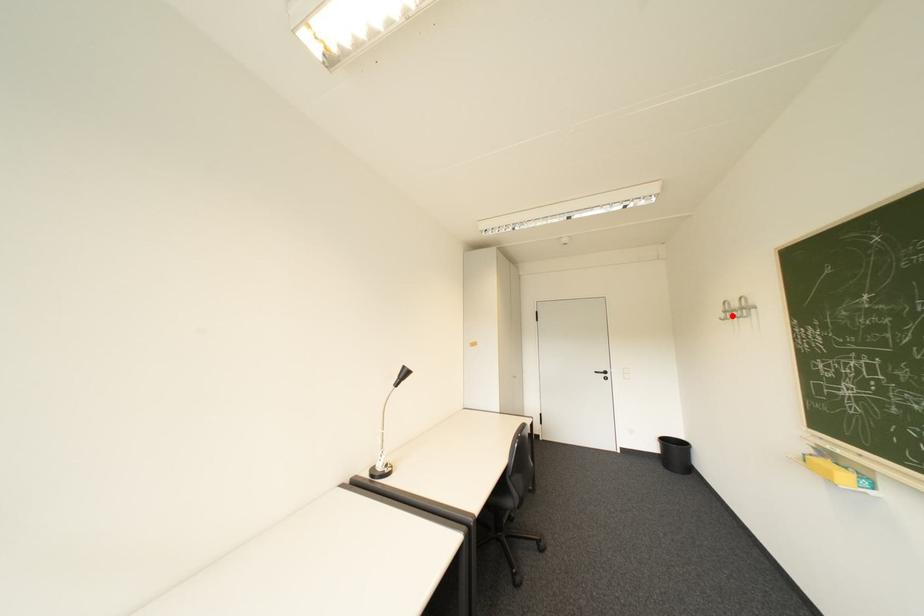
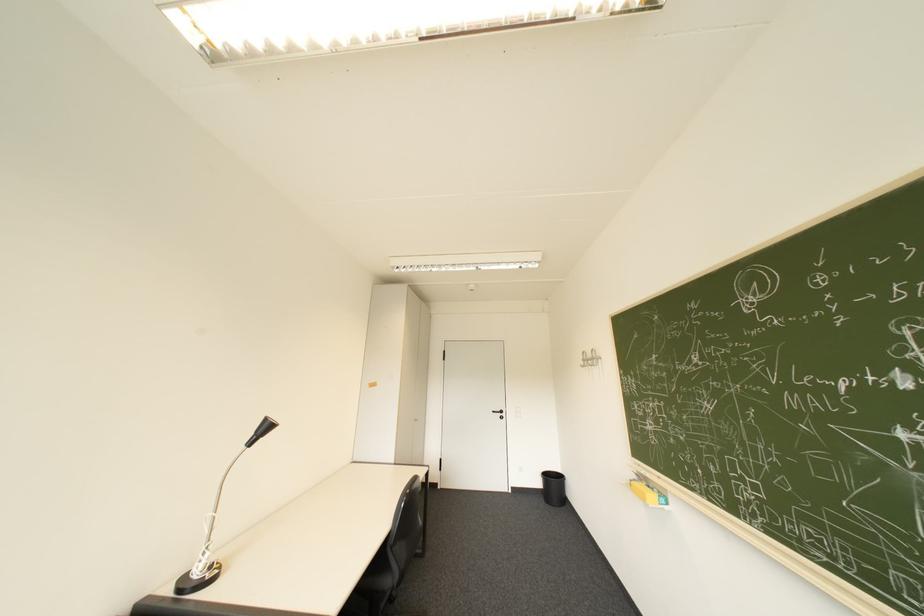
Find the pixel in the second image that matches the highlighted location in the first image.

(591, 363)